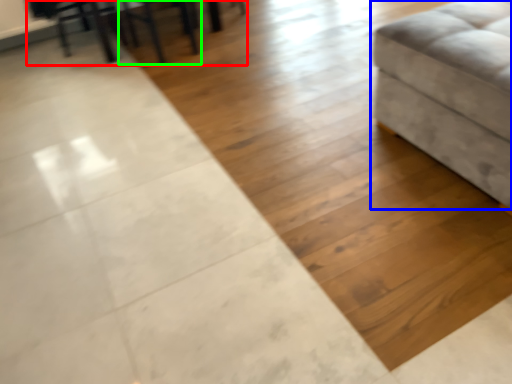
Question: Which object is positioned farthest from table (highlighted by a red box)? Select from furniture (highlighted by a blue box) and chair (highlighted by a green box).

Choices:
 (A) furniture
 (B) chair

Answer: (A)